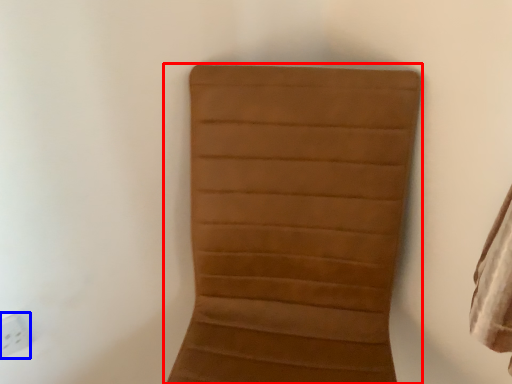
Question: Which object is closer to the camera taking this photo, furniture (highlighted by a red box) or electric outlet (highlighted by a blue box)?

Choices:
 (A) furniture
 (B) electric outlet

Answer: (A)